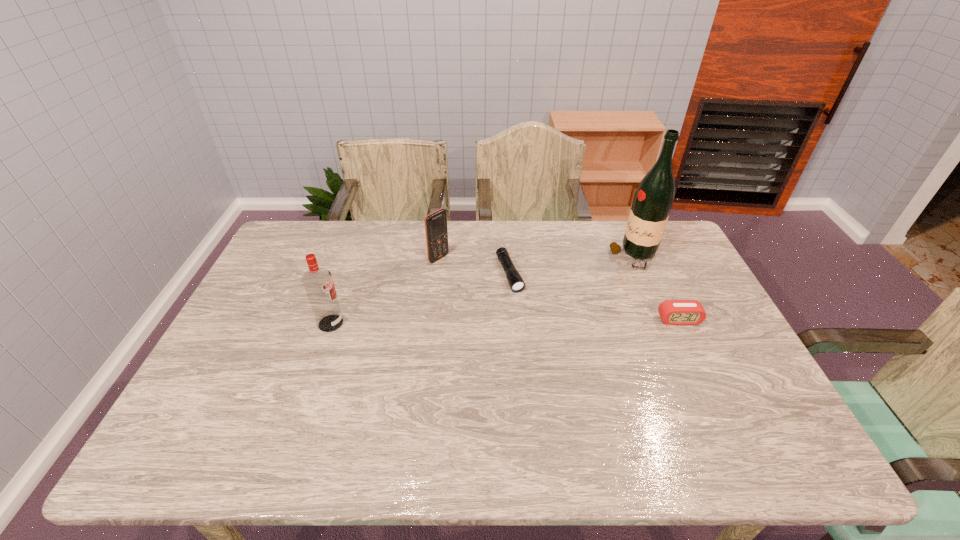
This screenshot has height=540, width=960. I want to click on object that can be found as the second closest to the alarm clock, so click(x=517, y=284).

The width and height of the screenshot is (960, 540). I want to click on free space that satisfies the following two spatial constraints: 1. on the front side of the shortest object; 2. on the left side of the third tallest object, so click(437, 274).